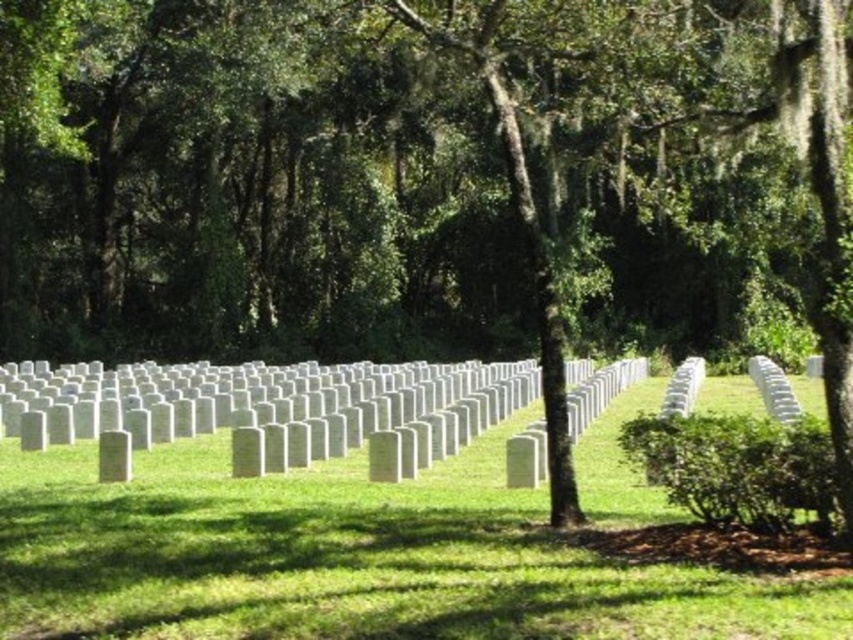
Question: Does green grass at center have a smaller size compared to white marble headstones at center?

Choices:
 (A) no
 (B) yes

Answer: (B)

Question: Does green grass at center have a smaller size compared to white marble headstones at center?

Choices:
 (A) no
 (B) yes

Answer: (B)

Question: Can you confirm if green grass at center is positioned below white marble headstones at center?

Choices:
 (A) yes
 (B) no

Answer: (A)